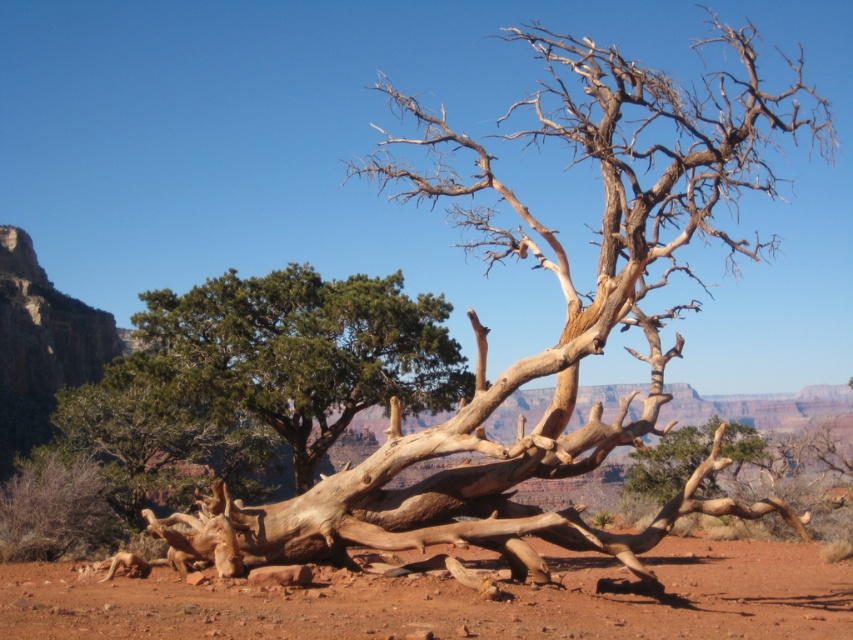
Question: Can you confirm if green textured tree at center is positioned to the right of light brown wood tree at center?

Choices:
 (A) no
 (B) yes

Answer: (A)

Question: Which point is farther from the camera taking this photo?

Choices:
 (A) (204, 400)
 (B) (636, 464)

Answer: (B)

Question: Is green textured tree at center further to camera compared to light brown wood tree at center?

Choices:
 (A) yes
 (B) no

Answer: (A)

Question: Which point is farther from the camera taking this photo?

Choices:
 (A) (630, 474)
 (B) (210, 339)

Answer: (A)

Question: Does green textured tree at center appear on the right side of light brown wood tree at center?

Choices:
 (A) no
 (B) yes

Answer: (A)